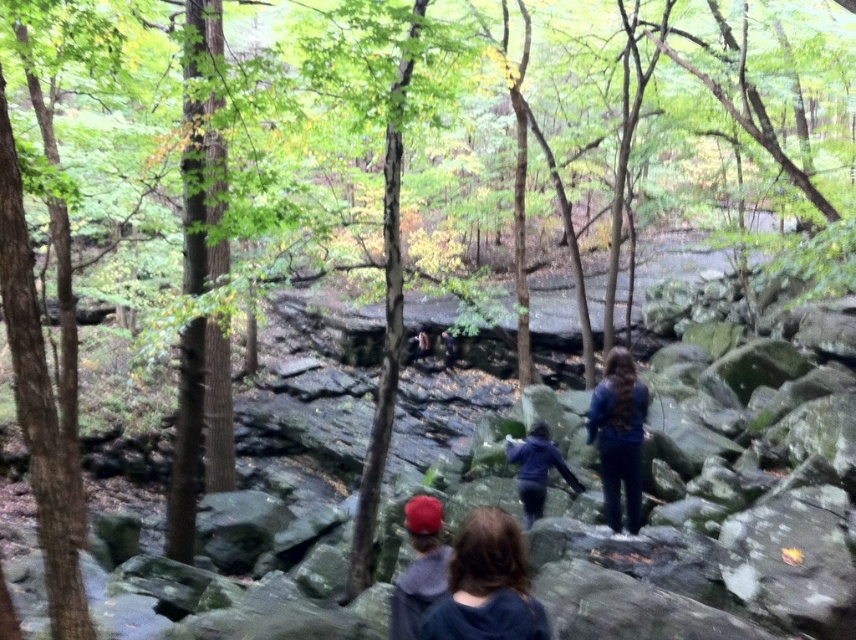
How far apart are dark blue fabric at center and dark blue jacket at center?

dark blue fabric at center is 18.29 feet away from dark blue jacket at center.

Consider the image. Can you confirm if dark blue fabric at center is shorter than dark blue jacket at center?

Yes.

Image resolution: width=856 pixels, height=640 pixels. What do you see at coordinates (486, 584) in the screenshot?
I see `dark blue fabric at center` at bounding box center [486, 584].

In order to click on dark blue fabric at center in this screenshot , I will do `click(486, 584)`.

Does dark blue fabric at center appear on the right side of red fabric cap at lower center?

Indeed, dark blue fabric at center is positioned on the right side of red fabric cap at lower center.

The image size is (856, 640). What do you see at coordinates (486, 584) in the screenshot? I see `dark blue fabric at center` at bounding box center [486, 584].

At what (x,y) coordinates should I click in order to perform the action: click on dark blue fabric at center. Please return your answer as a coordinate pair (x, y). The width and height of the screenshot is (856, 640). Looking at the image, I should click on (486, 584).

Which of these two, blue fabric at center or red fabric cap at lower center, stands taller?

Standing taller between the two is blue fabric at center.

Does point (634, 429) come behind point (414, 560)?

No, (634, 429) is in front of (414, 560).

Where is `blue fabric at center`? blue fabric at center is located at coordinates (619, 436).